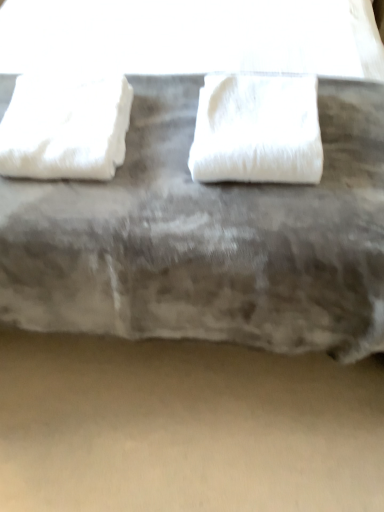
Question: From the image's perspective, would you say white fabric at center is shown under white fluffy towel at left, the first towel positioned from the left?

Choices:
 (A) no
 (B) yes

Answer: (A)

Question: Is white fabric at center facing away from white fluffy towel at left, the first towel positioned from the left?

Choices:
 (A) yes
 (B) no

Answer: (B)

Question: Can you confirm if white fabric at center is taller than white fluffy towel at left, which ranks as the 2th towel in right-to-left order?

Choices:
 (A) no
 (B) yes

Answer: (B)

Question: From a real-world perspective, is white fabric at center below white fluffy towel at left, which ranks as the 2th towel in right-to-left order?

Choices:
 (A) yes
 (B) no

Answer: (B)

Question: Is white fabric at center not within white fluffy towel at left, the first towel positioned from the left?

Choices:
 (A) yes
 (B) no

Answer: (A)

Question: Does white fabric at center appear on the right side of white fluffy towel at left, the first towel positioned from the left?

Choices:
 (A) no
 (B) yes

Answer: (B)

Question: Is white fluffy towel at center, acting as the second towel starting from the left, positioned with its back to white fabric at center?

Choices:
 (A) no
 (B) yes

Answer: (B)

Question: Considering the relative sizes of white fluffy towel at center, acting as the second towel starting from the left, and white fabric at center in the image provided, is white fluffy towel at center, acting as the second towel starting from the left, wider than white fabric at center?

Choices:
 (A) no
 (B) yes

Answer: (A)

Question: From the image's perspective, is white fluffy towel at center, acting as the second towel starting from the left, over white fabric at center?

Choices:
 (A) no
 (B) yes

Answer: (A)

Question: Can you confirm if white fluffy towel at center, the 1th towel from the right, is bigger than white fabric at center?

Choices:
 (A) no
 (B) yes

Answer: (A)

Question: Does white fluffy towel at center, acting as the second towel starting from the left, turn towards white fabric at center?

Choices:
 (A) yes
 (B) no

Answer: (A)

Question: Can you confirm if white fluffy towel at center, acting as the second towel starting from the left, is shorter than white fabric at center?

Choices:
 (A) no
 (B) yes

Answer: (B)

Question: Considering the relative sizes of beige matte concrete at lower center and white fabric at center in the image provided, is beige matte concrete at lower center wider than white fabric at center?

Choices:
 (A) no
 (B) yes

Answer: (A)